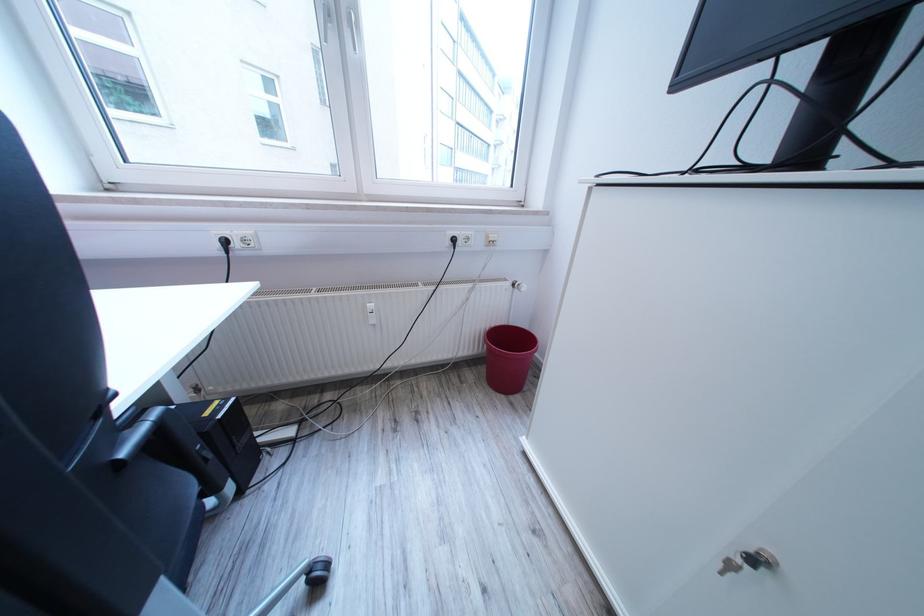
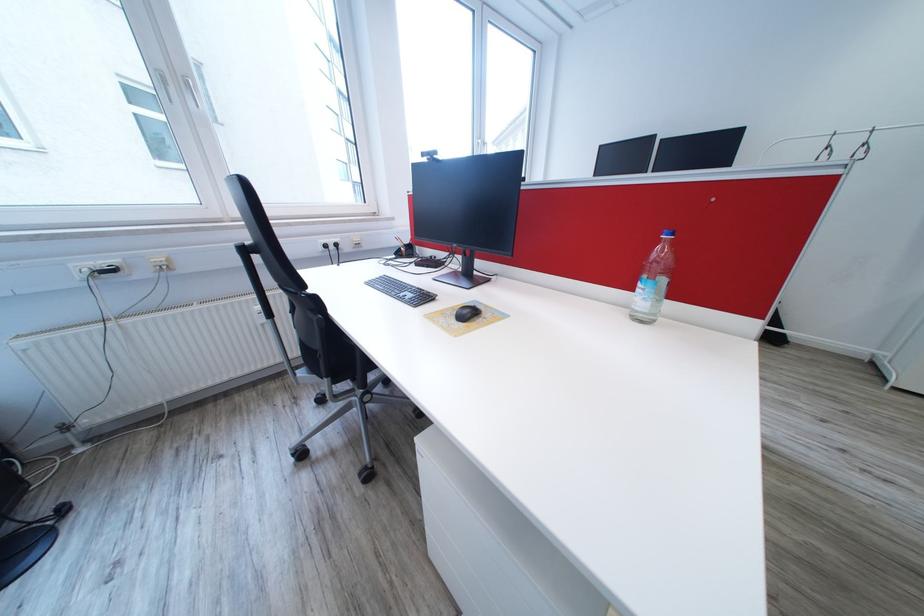
In a continuous first-person perspective shot, in which direction is the camera moving?

The movement direction of the cameraman is left, backward.